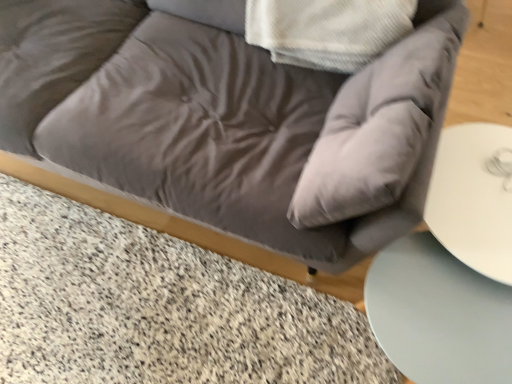
Question: Is smooth white table at lower right placed right next to satin gray couch at center?

Choices:
 (A) yes
 (B) no

Answer: (B)

Question: Is smooth white table at lower right oriented away from satin gray couch at center?

Choices:
 (A) yes
 (B) no

Answer: (B)

Question: Is smooth white table at lower right far from satin gray couch at center?

Choices:
 (A) yes
 (B) no

Answer: (B)

Question: Can you confirm if smooth white table at lower right is smaller than satin gray couch at center?

Choices:
 (A) yes
 (B) no

Answer: (A)

Question: Considering the relative sizes of smooth white table at lower right and satin gray couch at center in the image provided, is smooth white table at lower right wider than satin gray couch at center?

Choices:
 (A) no
 (B) yes

Answer: (A)

Question: From the image's perspective, relative to granite textured marble at lower left, is satin gray couch at center above or below?

Choices:
 (A) below
 (B) above

Answer: (B)

Question: Is point (46, 14) positioned closer to the camera than point (205, 291)?

Choices:
 (A) farther
 (B) closer

Answer: (A)

Question: Looking at the image, does satin gray couch at center seem bigger or smaller compared to granite textured marble at lower left?

Choices:
 (A) small
 (B) big

Answer: (B)

Question: From a real-world perspective, is satin gray couch at center above or below granite textured marble at lower left?

Choices:
 (A) above
 (B) below

Answer: (A)

Question: From a real-world perspective, is satin gray couch at center positioned above or below smooth white table at lower right?

Choices:
 (A) above
 (B) below

Answer: (A)

Question: Is satin gray couch at center taller or shorter than smooth white table at lower right?

Choices:
 (A) tall
 (B) short

Answer: (A)

Question: Is satin gray couch at center in front of or behind smooth white table at lower right in the image?

Choices:
 (A) front
 (B) behind

Answer: (A)

Question: Considering the positions of point (164, 210) and point (423, 296), is point (164, 210) closer or farther from the camera than point (423, 296)?

Choices:
 (A) closer
 (B) farther

Answer: (B)

Question: Considering the positions of granite textured marble at lower left and smooth white table at lower right in the image, is granite textured marble at lower left bigger or smaller than smooth white table at lower right?

Choices:
 (A) small
 (B) big

Answer: (A)

Question: Based on their positions, is granite textured marble at lower left located to the left or right of smooth white table at lower right?

Choices:
 (A) left
 (B) right

Answer: (A)